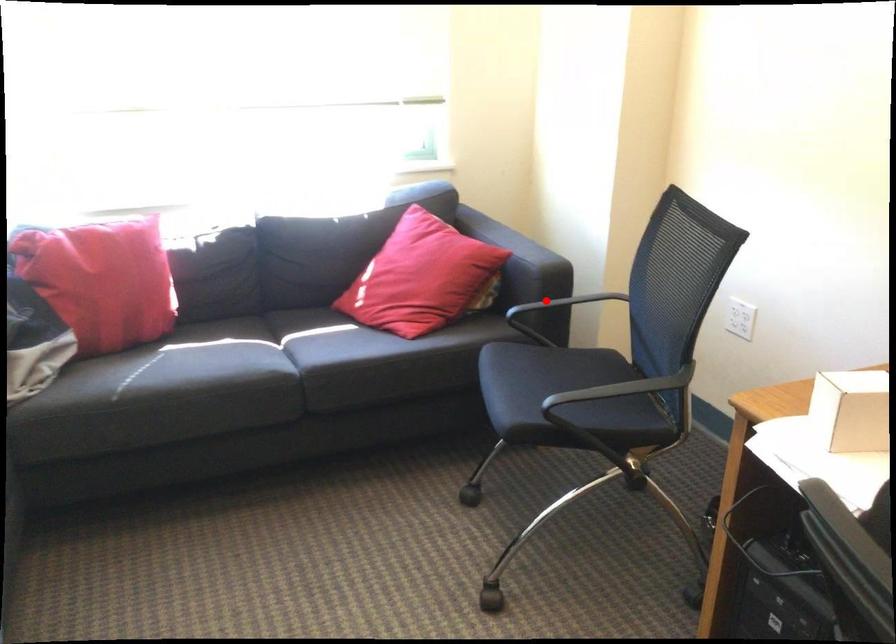
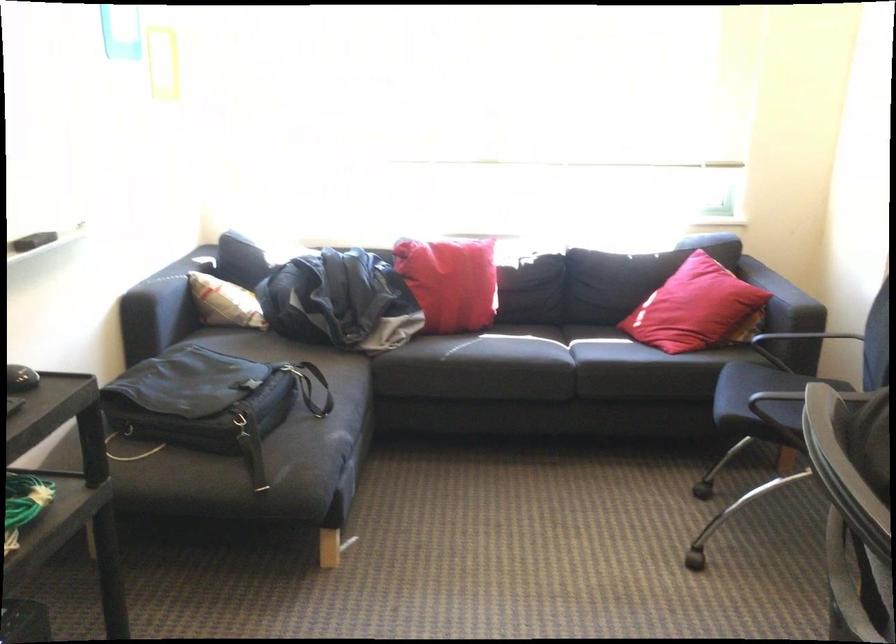
Question: I am providing you with two images of the same scene from different viewpoints. A red point is marked on the first image. Is the red point's position out of view in image 2?

Choices:
 (A) Yes
 (B) No

Answer: (B)